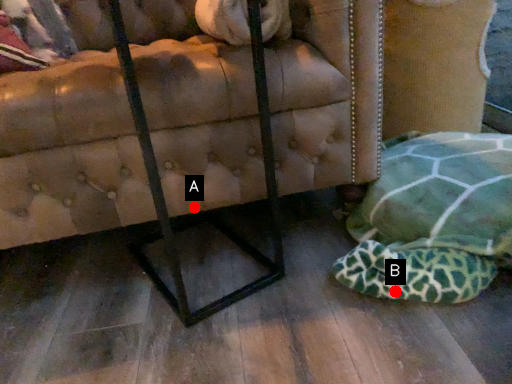
Question: Two points are circled on the image, labeled by A and B beside each circle. Which point is closer to the camera?

Choices:
 (A) A is closer
 (B) B is closer

Answer: (B)